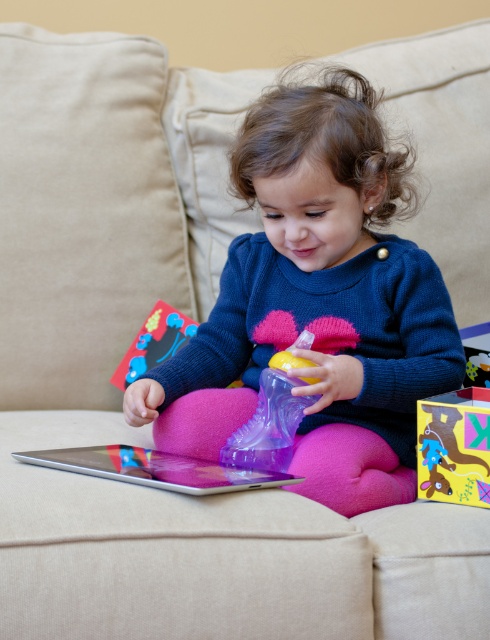
Looking at this image, who is higher up, matte cardboard box at center or matte plastic toy at center?

matte plastic toy at center is above.

Between point (469, 404) and point (181, 337), which one is positioned behind?

The point (181, 337) is behind.

You are a GUI agent. You are given a task and a screenshot of the screen. Output one action in this format:
    pyautogui.click(x=<x>, y=<y>)
    Task: Click on the matte cardboard box at center
    The height and width of the screenshot is (640, 490).
    Given the screenshot: What is the action you would take?
    pyautogui.click(x=455, y=445)

Does transparent plastic sippy cup at center appear on the right side of matte plastic toy at center?

Indeed, transparent plastic sippy cup at center is positioned on the right side of matte plastic toy at center.

Which is in front, point (273, 365) or point (130, 355)?

Positioned in front is point (273, 365).

Who is more distant from viewer, (305, 378) or (140, 355)?

Positioned behind is point (140, 355).

Identify the location of transparent plastic sippy cup at center. Image resolution: width=490 pixels, height=640 pixels. (272, 413).

Between point (471, 428) and point (278, 362), which one is positioned behind?

The point (278, 362) is more distant.

Which is more to the left, matte cardboard box at center or transparent plastic sippy cup at center?

transparent plastic sippy cup at center is more to the left.

Is point (426, 408) behind point (258, 412)?

No, it is not.

In order to click on matte cardboard box at center in this screenshot , I will do `click(455, 445)`.